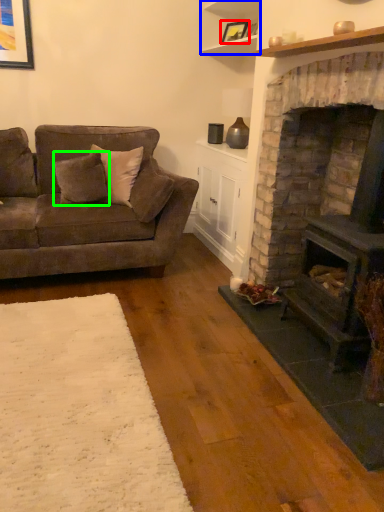
Question: Based on their relative distances, which object is nearer to picture frame (highlighted by a red box)? Choose from shelf (highlighted by a blue box) and pillow (highlighted by a green box).

Choices:
 (A) shelf
 (B) pillow

Answer: (A)